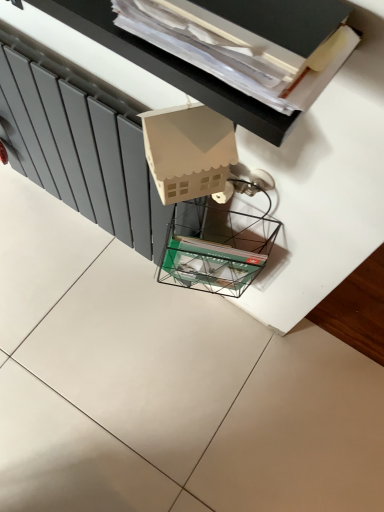
Identify the location of vacant area that is in front of matte gray radiator at left. The width and height of the screenshot is (384, 512). (96, 333).